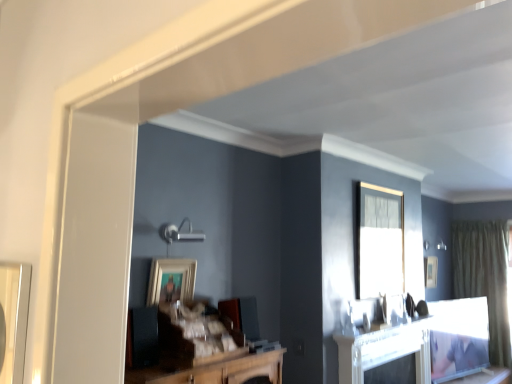
Image resolution: width=512 pixels, height=384 pixels. I want to click on white glossy fireplace at center, so click(384, 350).

Identify the location of green textured curtain at right. (484, 277).

You are a GUI agent. You are given a task and a screenshot of the screen. Output one action in this format:
    pyautogui.click(x=<x>, y=<y>)
    Task: Click on the matte black picture frame at upper right, positioned as the 1th picture frame in right-to-left order
    The height and width of the screenshot is (384, 512).
    Given the screenshot: What is the action you would take?
    pyautogui.click(x=430, y=271)

Locate an element on the screen. This screenshot has width=512, height=384. white glossy fireplace at center is located at coordinates (384, 350).

Can you tell me how much white glossy fireplace at center and green textured curtain at right differ in facing direction?

The angle between the facing direction of white glossy fireplace at center and the facing direction of green textured curtain at right is 90.5 degrees.

In the scene shown: Is white glossy fireplace at center far away from green textured curtain at right?

white glossy fireplace at center is positioned a significant distance from green textured curtain at right.

Is white glossy fireplace at center positioned with its back to green textured curtain at right?

No, white glossy fireplace at center is not facing the opposite direction of green textured curtain at right.

Is green textured curtain at right inside white glossy fireplace at center?

No, green textured curtain at right is not inside white glossy fireplace at center.

From the image's perspective, is wooden table at lower right over green textured curtain at right?

No, from the image's perspective, wooden table at lower right is not over green textured curtain at right.

Find the location of a particular element. Image resolution: width=512 pixels, height=384 pixels. curtain positioned vertically above the wooden table at lower right (from a real-world perspective) is located at coordinates (484, 277).

Is wooden table at lower right inside or outside of green textured curtain at right?

wooden table at lower right exists outside the volume of green textured curtain at right.

Could you tell me if wooden table at lower right is facing green textured curtain at right?

No, wooden table at lower right is not facing towards green textured curtain at right.

In the scene shown: Is white glossy fireplace at center turned away from matte black picture frame at upper right, positioned as the 1th picture frame in right-to-left order?

No, white glossy fireplace at center is not facing the opposite direction of matte black picture frame at upper right, positioned as the 1th picture frame in right-to-left order.

Does white glossy fireplace at center appear on the right side of matte black picture frame at upper right, the second picture frame in the left-to-right sequence?

In fact, white glossy fireplace at center is to the left of matte black picture frame at upper right, the second picture frame in the left-to-right sequence.

Considering the sizes of white glossy fireplace at center and matte black picture frame at upper right, which is counted as the 2th picture frame, starting from the top, in the image, is white glossy fireplace at center bigger or smaller than matte black picture frame at upper right, which is counted as the 2th picture frame, starting from the top,?

white glossy fireplace at center is bigger than matte black picture frame at upper right, which is counted as the 2th picture frame, starting from the top.

From a real-world perspective, is white glossy fireplace at center physically above matte black picture frame at upper right, which is counted as the 2th picture frame, starting from the front?

No, from a real-world perspective, white glossy fireplace at center is not over matte black picture frame at upper right, which is counted as the 2th picture frame, starting from the front

Looking at this image, what's the angular difference between green textured curtain at right and white glossy fireplace at center's facing directions?

The angular difference between green textured curtain at right and white glossy fireplace at center is 90.5 degrees.

Does green textured curtain at right appear on the right side of white glossy fireplace at center?

Indeed, green textured curtain at right is positioned on the right side of white glossy fireplace at center.

Does green textured curtain at right have a larger size compared to white glossy fireplace at center?

Yes, green textured curtain at right is bigger than white glossy fireplace at center.

Is green textured curtain at right oriented towards white glossy fireplace at center?

Yes, green textured curtain at right is aimed at white glossy fireplace at center.

Which object is wider, matte black picture frame at upper right, which is counted as the 2th picture frame, starting from the top, or wooden table at lower right?

With larger width is wooden table at lower right.

Is matte black picture frame at upper right, which is counted as the 2th picture frame, starting from the top, outside of wooden table at lower right?

That's correct, matte black picture frame at upper right, which is counted as the 2th picture frame, starting from the top, is outside of wooden table at lower right.

Does matte black picture frame at upper right, which is counted as the 1th picture frame, starting from the back, have a greater height compared to wooden table at lower right?

Indeed, matte black picture frame at upper right, which is counted as the 1th picture frame, starting from the back, has a greater height compared to wooden table at lower right.

How many degrees apart are the facing directions of matte black picture frame at upper right, which is counted as the 1th picture frame, starting from the back, and wooden table at lower right?

The facing directions of matte black picture frame at upper right, which is counted as the 1th picture frame, starting from the back, and wooden table at lower right are 1.02 degrees apart.

Are wooden framed picture at center, positioned as the second picture frame in right-to-left order, and clear glass window at upper center located far from each other?

Indeed, wooden framed picture at center, positioned as the second picture frame in right-to-left order, is not near clear glass window at upper center.

Measure the distance between wooden framed picture at center, which appears as the 2th picture frame when viewed from the back, and clear glass window at upper center.

wooden framed picture at center, which appears as the 2th picture frame when viewed from the back, is 1.55 meters away from clear glass window at upper center.

Which object is positioned more to the left, wooden framed picture at center, positioned as the second picture frame in right-to-left order, or clear glass window at upper center?

From the viewer's perspective, wooden framed picture at center, positioned as the second picture frame in right-to-left order, appears more on the left side.

The image size is (512, 384). Identify the location of picture frame in front of the clear glass window at upper center. (170, 280).

Would you say white glossy fireplace at center is inside or outside clear glass window at upper center?

The correct answer is: outside.

From the image's perspective, which is above, white glossy fireplace at center or clear glass window at upper center?

clear glass window at upper center, from the image's perspective.

Is white glossy fireplace at center positioned far away from clear glass window at upper center?

No, white glossy fireplace at center is in close proximity to clear glass window at upper center.

Locate an element on the screen. The image size is (512, 384). fireplace on the left side of green textured curtain at right is located at coordinates point(384,350).

What are the coordinates of `curtain that is behind the wooden table at lower right` in the screenshot? It's located at (484, 277).

Looking at the image, which one is located closer to wooden table at lower right, matte black picture frame at upper right, the second picture frame in the left-to-right sequence, or wooden framed picture at center, which is the 1th picture frame in front-to-back order?

The object closer to wooden table at lower right is matte black picture frame at upper right, the second picture frame in the left-to-right sequence.

Estimate the real-world distances between objects in this image. Which object is closer to wooden table at lower right, wooden framed picture at center, which appears as the 2th picture frame when viewed from the back, or green textured curtain at right?

Among the two, green textured curtain at right is located nearer to wooden table at lower right.

Based on their spatial positions, is clear glass window at upper center or white glossy fireplace at center further from wooden framed picture at center, which appears as the 1th picture frame when viewed from the top?

Based on the image, clear glass window at upper center appears to be further to wooden framed picture at center, which appears as the 1th picture frame when viewed from the top.

Considering their positions, is green textured curtain at right positioned closer to white glossy fireplace at center than matte black picture frame at upper right, positioned as the 1th picture frame in right-to-left order?

matte black picture frame at upper right, positioned as the 1th picture frame in right-to-left order, lies closer to white glossy fireplace at center than the other object.

Based on their spatial positions, is matte black picture frame at upper right, positioned as the 1th picture frame in right-to-left order, or white glossy fireplace at center closer to wooden table at lower right?

matte black picture frame at upper right, positioned as the 1th picture frame in right-to-left order, is closer to wooden table at lower right.

Estimate the real-world distances between objects in this image. Which object is further from matte black picture frame at upper right, the second picture frame in the left-to-right sequence, green textured curtain at right or clear glass window at upper center?

clear glass window at upper center is further to matte black picture frame at upper right, the second picture frame in the left-to-right sequence.

When comparing their distances from wooden table at lower right, does wooden framed picture at center, positioned as the second picture frame in right-to-left order, or white glossy fireplace at center seem closer?

Based on the image, white glossy fireplace at center appears to be nearer to wooden table at lower right.

Based on their spatial positions, is clear glass window at upper center or wooden framed picture at center, which is the 1th picture frame in front-to-back order, further from green textured curtain at right?

Among the two, wooden framed picture at center, which is the 1th picture frame in front-to-back order, is located further to green textured curtain at right.

In order to click on picture frame between white glossy fireplace at center and green textured curtain at right along the z-axis in this screenshot , I will do `click(430, 271)`.

Where is `picture frame situated between wooden framed picture at center, which is the 1th picture frame in front-to-back order, and green textured curtain at right from left to right`? picture frame situated between wooden framed picture at center, which is the 1th picture frame in front-to-back order, and green textured curtain at right from left to right is located at coordinates (430, 271).

Identify the location of window between white glossy fireplace at center and matte black picture frame at upper right, positioned as the 1th picture frame in right-to-left order, from front to back. (379, 241).

Locate an element on the screen. The image size is (512, 384). curtain between matte black picture frame at upper right, which is counted as the 2th picture frame, starting from the top, and wooden table at lower right in the up-down direction is located at coordinates (484, 277).